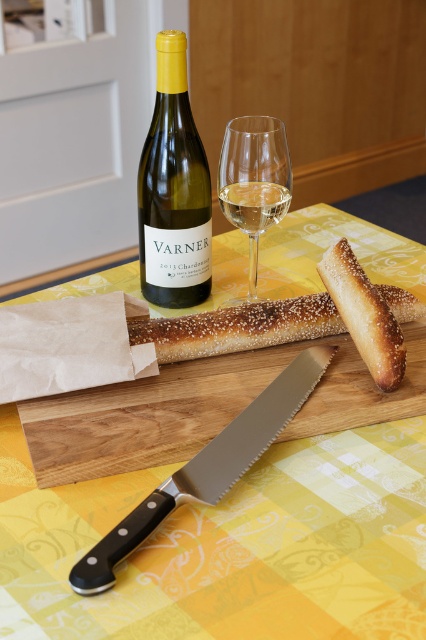
You are standing at the edge of the table and want to move an object from point (x=253, y=225) to point (x=235, y=440). Which direction should you move it?

You should move the object from point (x=253, y=225) towards the front of the table to reach point (x=235, y=440) since it is in front.

You are a guest at a dinner party and want to reach for the serrated silver knife at center and the clear glass wine at upper center. Which object is larger?

The serrated silver knife at center is bigger than the clear glass wine at upper center, so the serrated silver knife at center is larger.